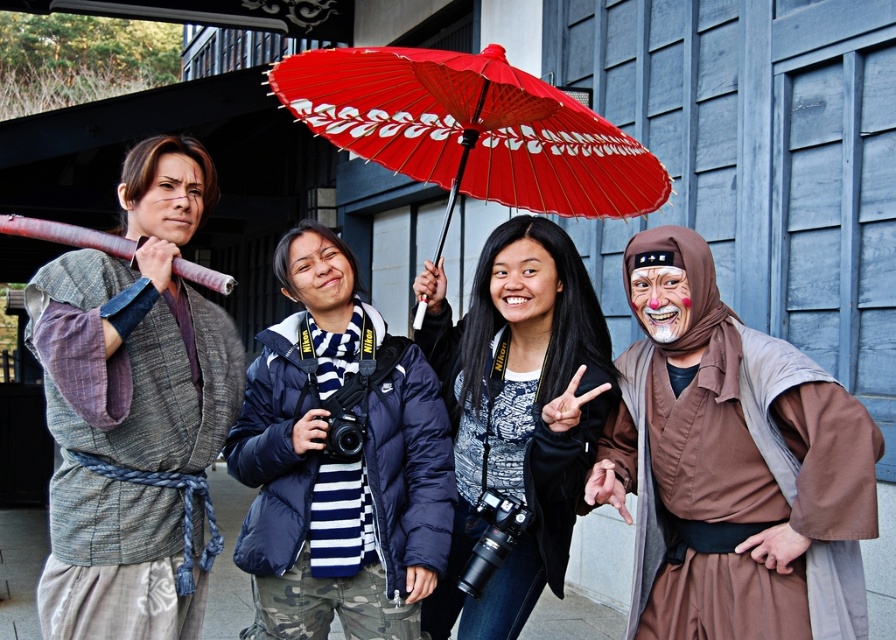
You are a photographer standing in front of the scene. You want to take a photo of the matte black jacket at center and the navy blue puffer jacket at center. Which one is more likely to be fully visible in the photo?

The navy blue puffer jacket at center is more likely to be fully visible because the matte black jacket at center is positioned behind it.

You are an artist trying to sketch the scene. You notice the brown fabric mask at right and the matte black jacket at center. Which object should you draw first if you want to focus on the larger one?

The matte black jacket at center should be drawn first because it occupies more space than the brown fabric mask at right.